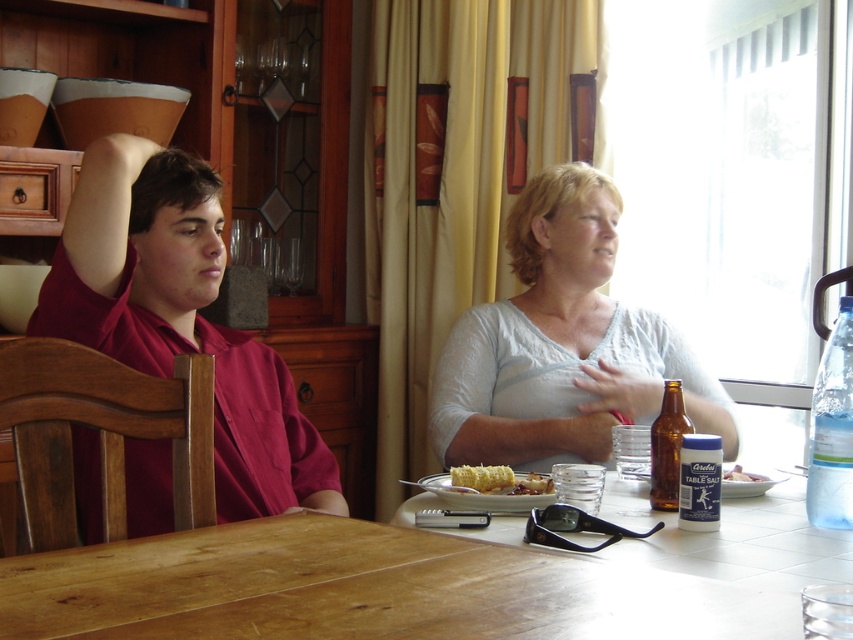
Question: Is the position of wooden table at center more distant than that of yellow matte corn at center?

Choices:
 (A) no
 (B) yes

Answer: (A)

Question: Does matte red shirt at left have a smaller size compared to yellow matte corn at center?

Choices:
 (A) no
 (B) yes

Answer: (A)

Question: Which point is closer to the camera taking this photo?

Choices:
 (A) (485, 480)
 (B) (299, 532)
 (C) (612, 220)

Answer: (B)

Question: Which object is the farthest from the white lace shirt at center?

Choices:
 (A) wooden table at center
 (B) matte red shirt at left
 (C) yellow crumbly cake at lower center

Answer: (A)

Question: Which object is the closest to the yellow cake at center?

Choices:
 (A) yellow crumbly cake at lower center
 (B) yellow matte corn at center

Answer: (A)

Question: Is matte red shirt at left positioned behind yellow cake at center?

Choices:
 (A) no
 (B) yes

Answer: (A)